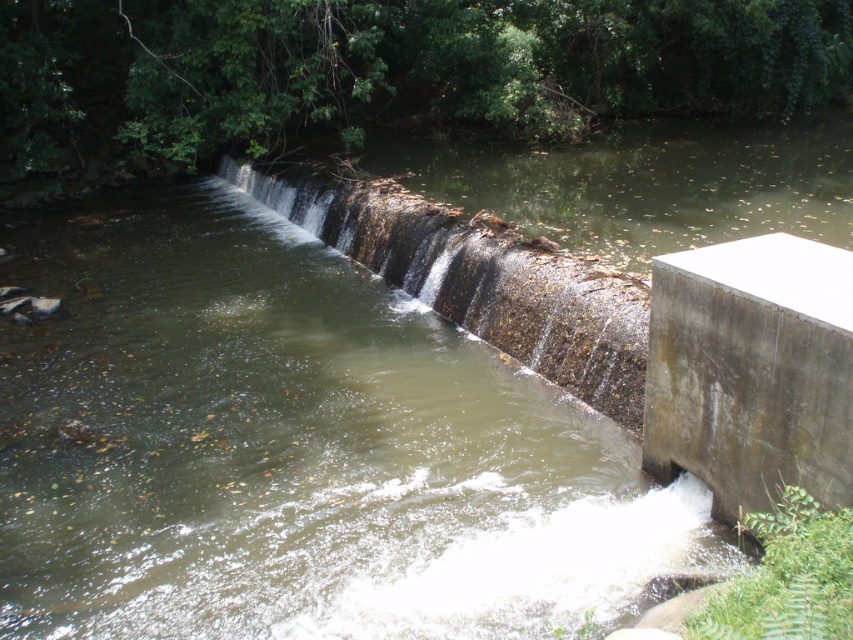
Can you confirm if gray concrete wall at lower right is wider than brown textured concrete waterfall at center?

No.

Between gray concrete wall at lower right and brown textured concrete waterfall at center, which one has less height?

gray concrete wall at lower right is shorter.

Which is behind, point (761, 502) or point (387, 257)?

The point (387, 257) is behind.

This screenshot has width=853, height=640. What are the coordinates of `gray concrete wall at lower right` in the screenshot? It's located at (751, 371).